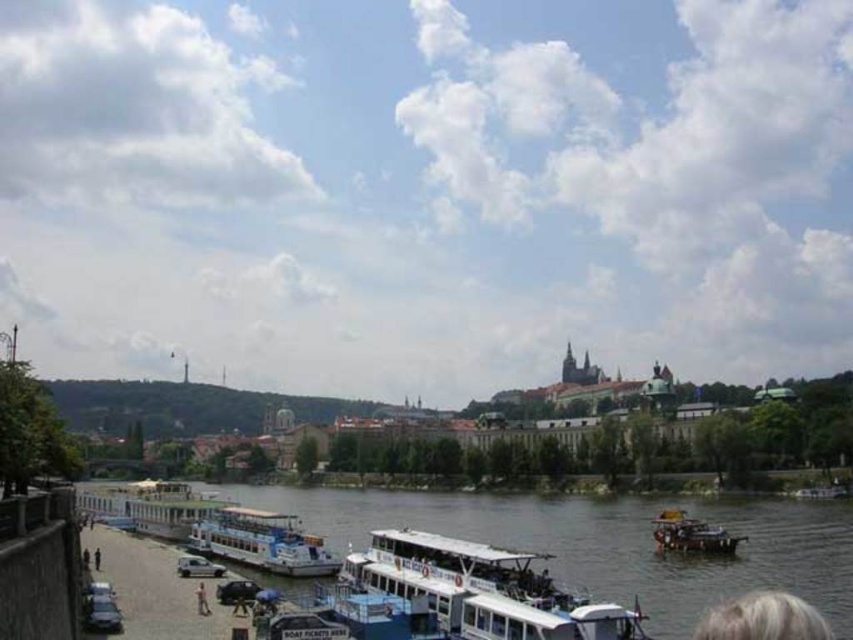
Does white plastic boat at lower center appear over wooden boat at lower right?

Correct, white plastic boat at lower center is located above wooden boat at lower right.

Between white plastic boat at lower center and wooden boat at lower right, which one has more height?

Standing taller between the two is wooden boat at lower right.

Between point (202, 540) and point (682, 516), which one is positioned behind?

The point (682, 516) is more distant.

What are the coordinates of `white plastic boat at lower center` in the screenshot? It's located at (260, 541).

Locate an element on the screen. The height and width of the screenshot is (640, 853). white plastic boat at lower center is located at coordinates (260, 541).

Who is positioned more to the left, white plastic boat at lower center or white fabric umbrella at lower center?

white fabric umbrella at lower center is more to the left.

The image size is (853, 640). Find the location of `white plastic boat at lower center`. white plastic boat at lower center is located at coordinates (260, 541).

This screenshot has height=640, width=853. I want to click on white plastic boat at lower center, so click(x=260, y=541).

Consider the image. Who is more distant from viewer, [724,532] or [93,561]?

Point [724,532]

Image resolution: width=853 pixels, height=640 pixels. What do you see at coordinates (691, 534) in the screenshot?
I see `wooden boat at lower right` at bounding box center [691, 534].

Where is `wooden boat at lower right`? The height and width of the screenshot is (640, 853). wooden boat at lower right is located at coordinates (x=691, y=534).